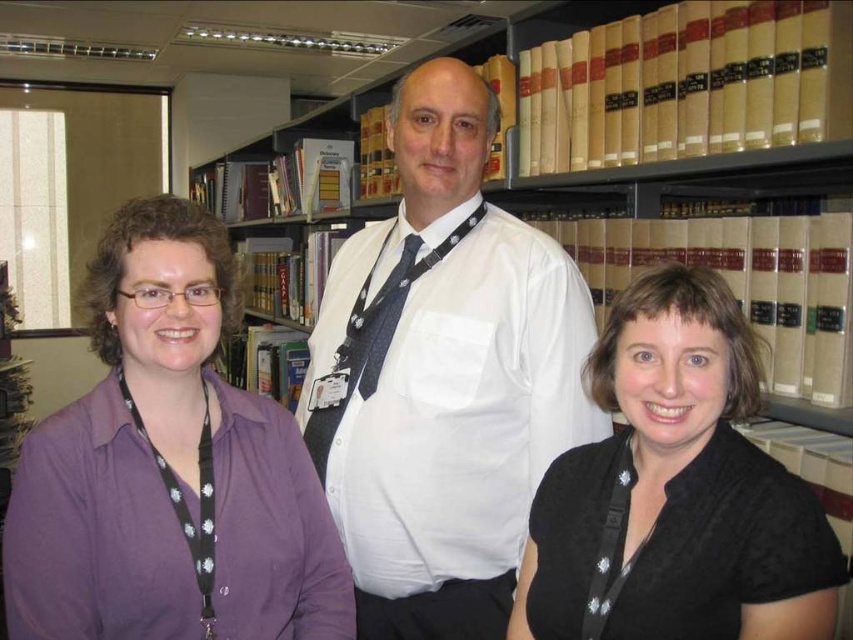
Question: Which object is farther from the camera taking this photo?

Choices:
 (A) purple shirt at left
 (B) white shirt at center

Answer: (B)

Question: Can you confirm if white shirt at center is bigger than dark blue textured tie at center?

Choices:
 (A) yes
 (B) no

Answer: (A)

Question: Is purple shirt at left to the left of black textured blouse at lower right from the viewer's perspective?

Choices:
 (A) yes
 (B) no

Answer: (A)

Question: Is black textured blouse at lower right below dark blue textured tie at center?

Choices:
 (A) no
 (B) yes

Answer: (B)

Question: Which point is closer to the camera taking this photo?

Choices:
 (A) (403, 252)
 (B) (173, 355)

Answer: (B)

Question: Which object is the farthest from the white shirt at center?

Choices:
 (A) dark blue textured tie at center
 (B) black textured blouse at lower right

Answer: (B)